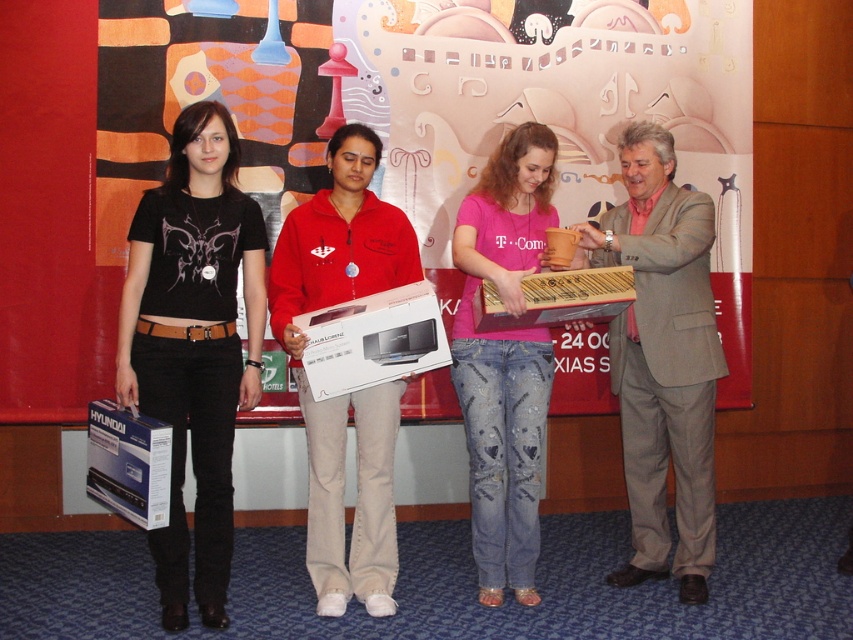
Question: Which point is closer to the camera?

Choices:
 (A) matte red hoodie at center
 (B) light brown suit at right

Answer: (A)

Question: Is the position of light brown suit at right more distant than that of matte red hoodie at center?

Choices:
 (A) yes
 (B) no

Answer: (A)

Question: Which of the following is the closest to the observer?

Choices:
 (A) (636, 563)
 (B) (231, 268)
 (C) (334, 237)

Answer: (B)

Question: Where is black matte t-shirt at center located in relation to light brown suit at right in the image?

Choices:
 (A) above
 (B) below

Answer: (A)

Question: Which point is farther to the camera?

Choices:
 (A) (503, 484)
 (B) (224, 364)
 (C) (624, 460)

Answer: (C)

Question: Does black matte t-shirt at center appear on the left side of pink cotton shirt at center?

Choices:
 (A) yes
 (B) no

Answer: (A)